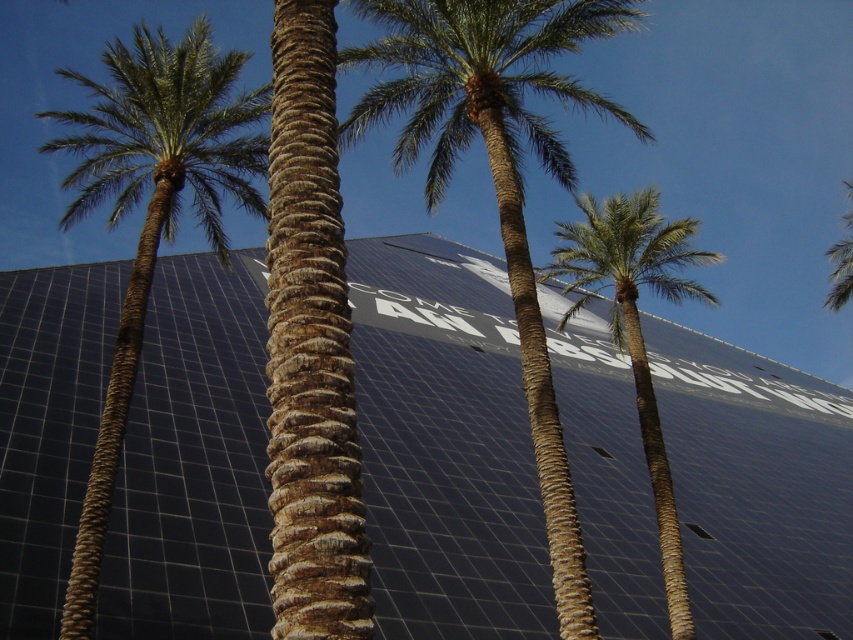
Which is in front, point (784, 618) or point (596, 276)?

Positioned in front is point (596, 276).

Between black glass building at center and green leafy palm at center, which one has more height?

With more height is green leafy palm at center.

Find the location of a particular element. black glass building at center is located at coordinates (445, 444).

Which of these two, green leafy palm tree at center or green leafy palm tree at left, stands shorter?

With less height is green leafy palm tree at left.

Can you confirm if green leafy palm tree at center is smaller than green leafy palm tree at left?

Yes, green leafy palm tree at center is smaller than green leafy palm tree at left.

Is point (579, 612) closer to viewer compared to point (144, 237)?

Yes, point (579, 612) is in front of point (144, 237).

Identify the location of green leafy palm tree at center. (497, 173).

Can you confirm if black glass building at center is shorter than green leafy palm tree at center?

Yes, black glass building at center is shorter than green leafy palm tree at center.

Who is more forward, (x=106, y=564) or (x=628, y=128)?

Point (x=106, y=564) is more forward.

Who is more distant from viewer, (x=183, y=604) or (x=427, y=42)?

The point (x=427, y=42) is behind.

Locate an element on the screen. black glass building at center is located at coordinates (445, 444).